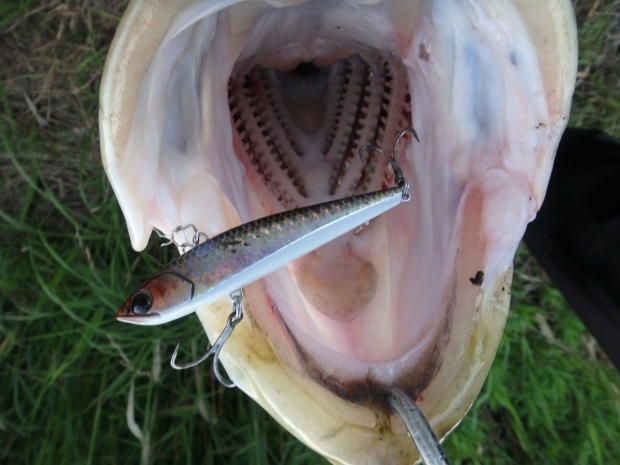
Identify the location of hook. The width and height of the screenshot is (620, 465). (222, 339), (396, 170).